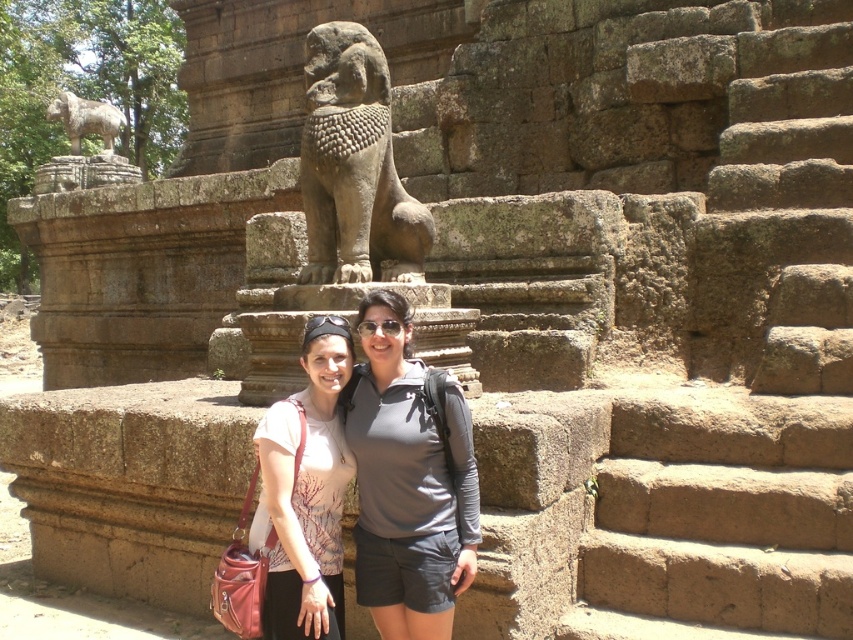
Question: Which is farther from the gray matte shirt at center?

Choices:
 (A) gray stone lion at upper left
 (B) matte white blouse at center

Answer: (A)

Question: Is matte white blouse at center in front of gray stone lion at upper left?

Choices:
 (A) no
 (B) yes

Answer: (B)

Question: Does gray stone lion at center appear on the left side of gray stone lion at upper left?

Choices:
 (A) no
 (B) yes

Answer: (A)

Question: Is gray matte shirt at center below matte white blouse at center?

Choices:
 (A) yes
 (B) no

Answer: (A)

Question: Which of the following is the farthest from the observer?

Choices:
 (A) (305, 632)
 (B) (317, 109)

Answer: (B)

Question: Which object appears closest to the camera in this image?

Choices:
 (A) gray stone lion at upper left
 (B) gray matte shirt at center
 (C) gray stone lion at center

Answer: (B)